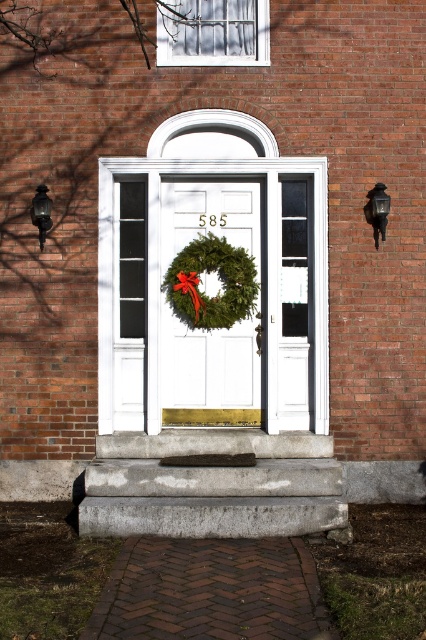
Is white matte door at center to the left of matte black lantern at left from the viewer's perspective?

No, white matte door at center is not to the left of matte black lantern at left.

What do you see at coordinates (210, 305) in the screenshot? The width and height of the screenshot is (426, 640). I see `white matte door at center` at bounding box center [210, 305].

This screenshot has width=426, height=640. Identify the location of white matte door at center. (210, 305).

Does gray concrete stairs at lower center have a lesser height compared to white matte door at center?

Correct, gray concrete stairs at lower center is not as tall as white matte door at center.

Where is `gray concrete stairs at lower center`? Image resolution: width=426 pixels, height=640 pixels. gray concrete stairs at lower center is located at coordinates (212, 486).

Does white matte door at center have a greater height compared to green matte wreath at center?

Yes, white matte door at center is taller than green matte wreath at center.

Is white matte door at center wider than green matte wreath at center?

Yes.

Between point (233, 424) and point (241, 276), which one is positioned behind?

The point (233, 424) is more distant.

This screenshot has width=426, height=640. I want to click on white matte door at center, so click(x=210, y=305).